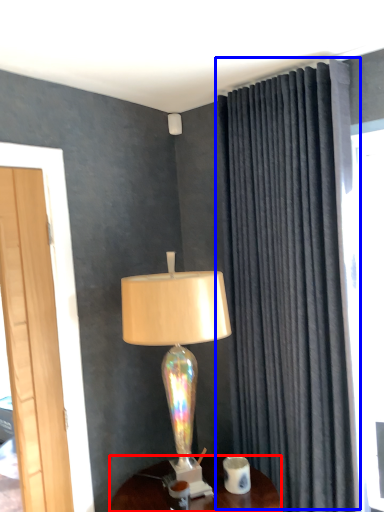
Question: Which point is closer to the camera, desk (highlighted by a red box) or curtain (highlighted by a blue box)?

Choices:
 (A) desk
 (B) curtain

Answer: (A)